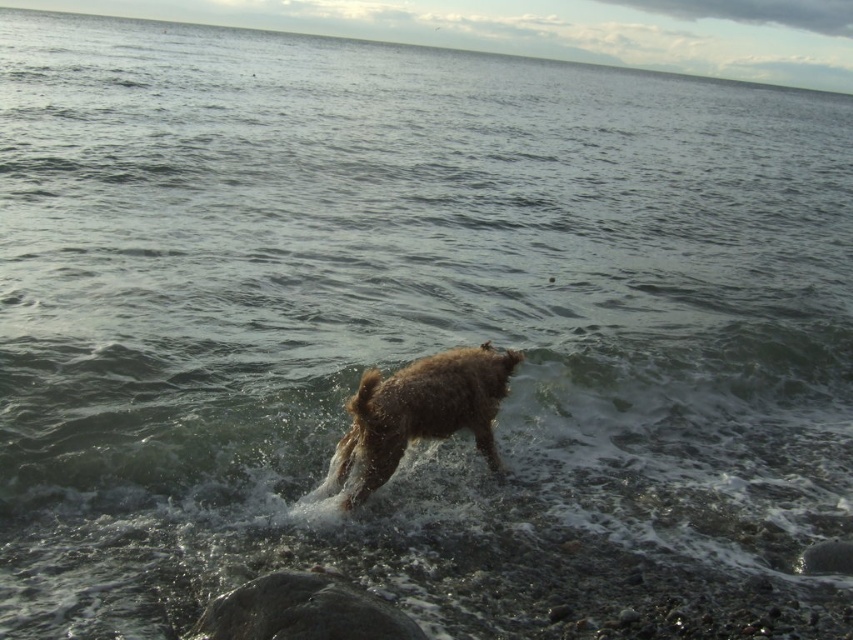
Which is behind, point (471, 352) or point (366, 595)?

Point (471, 352)

Who is more forward, (395, 440) or (312, 620)?

Point (312, 620) is more forward.

Find the location of a particular element. brown furry dog at center is located at coordinates (422, 410).